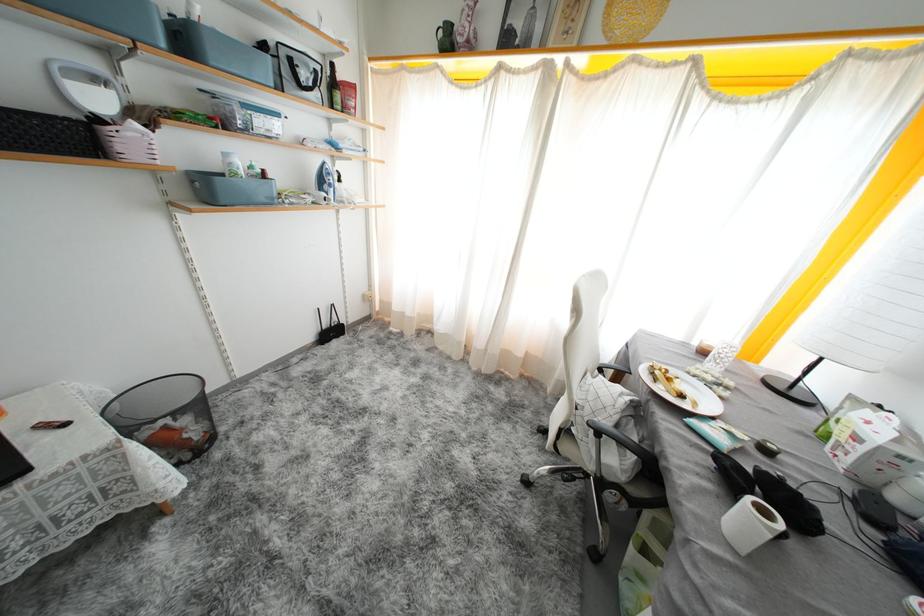
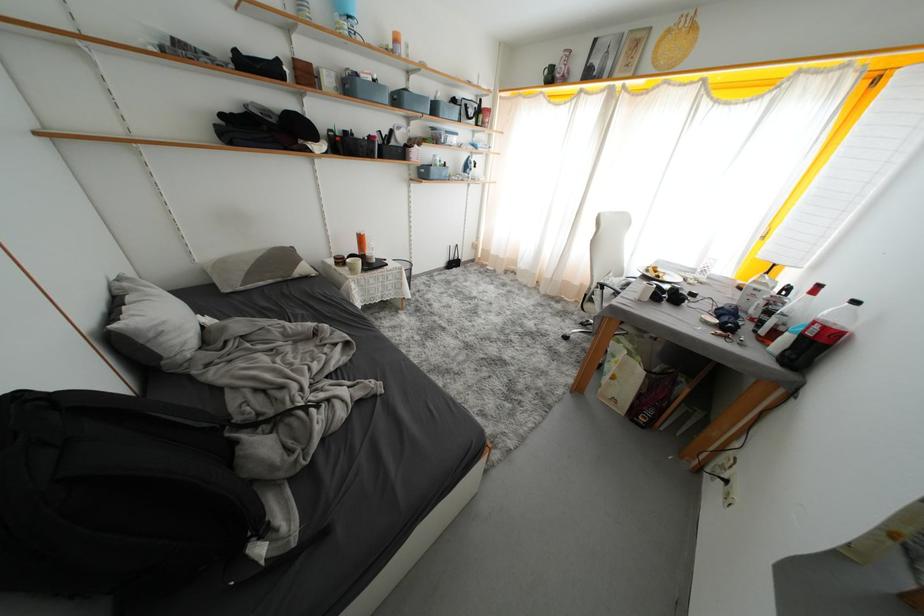
Locate, in the second image, the point that corresponds to (567,435) in the first image.

(591, 299)